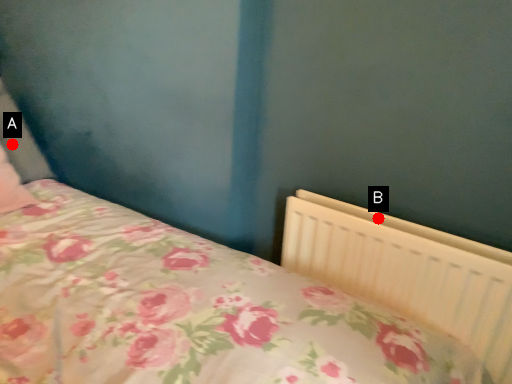
Question: Two points are circled on the image, labeled by A and B beside each circle. Among these points, which one is farthest from the camera?

Choices:
 (A) A is further
 (B) B is further

Answer: (A)